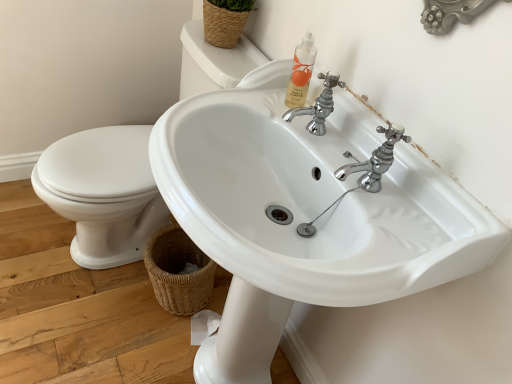
Image resolution: width=512 pixels, height=384 pixels. I want to click on free location in front of brown woven basket at lower left, positioned as the first basket in bottom-to-top order, so click(x=143, y=352).